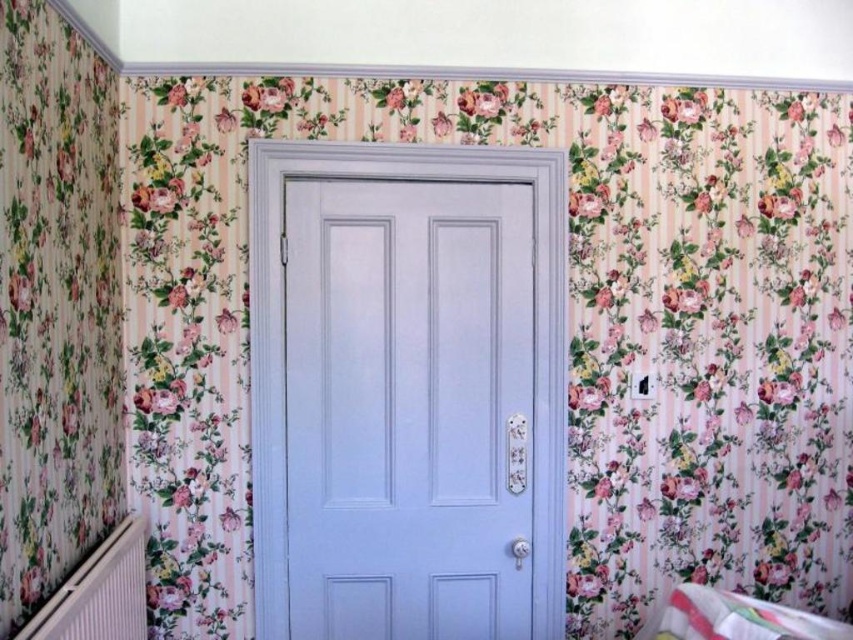
You are standing in a room with floral wallpaper and want to locate the door. The door is represented by the point at coordinates (408, 406). Based on the coordinates, where is the door located in the room?

The door is located at the center of the room, as the coordinates point (408, 406) represent the matte white door at center.

You are moving a large piece of furniture into the room and need to ensure it fits through the doorway. The furniture is as wide as the multicolored fabric infant bed at lower right. Can the furniture pass through the matte white door at center?

The matte white door at center might be wider than multicolored fabric infant bed at lower right, so there is a possibility that the furniture can pass through the door. However, since the width comparison is uncertain, it would be safer to measure both dimensions before attempting to move the furniture through the doorway.